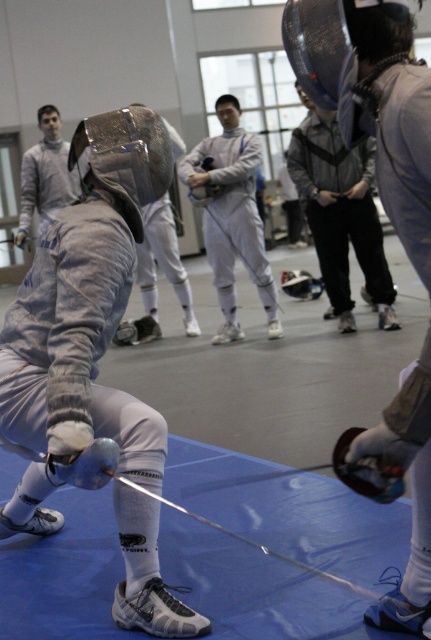
Which is more to the left, gray fabric jacket at center or matte silver fencing mask at upper left?

matte silver fencing mask at upper left

Is gray fabric jacket at center to the left of matte silver fencing mask at upper left from the viewer's perspective?

Incorrect, gray fabric jacket at center is not on the left side of matte silver fencing mask at upper left.

Locate an element on the screen. The image size is (431, 640). gray fabric jacket at center is located at coordinates (340, 212).

The image size is (431, 640). What are the coordinates of `gray fabric jacket at center` in the screenshot? It's located at (340, 212).

Can you confirm if gray fabric jacket at center is bigger than shiny silver helmet at center?

Yes, gray fabric jacket at center is bigger than shiny silver helmet at center.

In the scene shown: Does gray fabric jacket at center have a greater width compared to shiny silver helmet at center?

Yes, gray fabric jacket at center is wider than shiny silver helmet at center.

Which is behind, point (325, 275) or point (177, 280)?

Positioned behind is point (177, 280).

What are the coordinates of `gray fabric jacket at center` in the screenshot? It's located at (340, 212).

Consider the image. Which is more to the left, shiny silver helmet at center or matte silver fencing mask at upper left?

From the viewer's perspective, matte silver fencing mask at upper left appears more on the left side.

From the picture: Can you confirm if shiny silver helmet at center is positioned to the right of matte silver fencing mask at upper left?

Correct, you'll find shiny silver helmet at center to the right of matte silver fencing mask at upper left.

Image resolution: width=431 pixels, height=640 pixels. I want to click on shiny silver helmet at center, so click(156, 275).